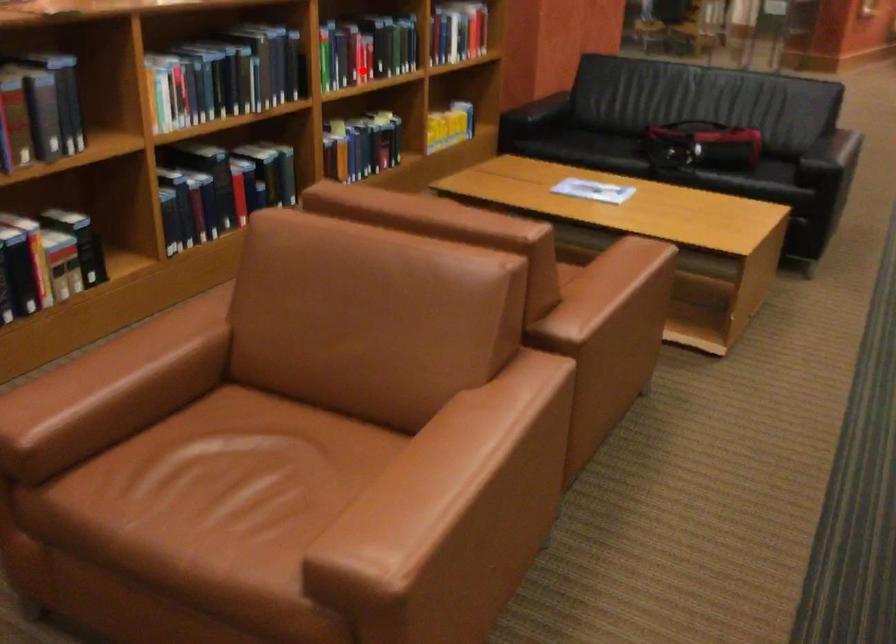
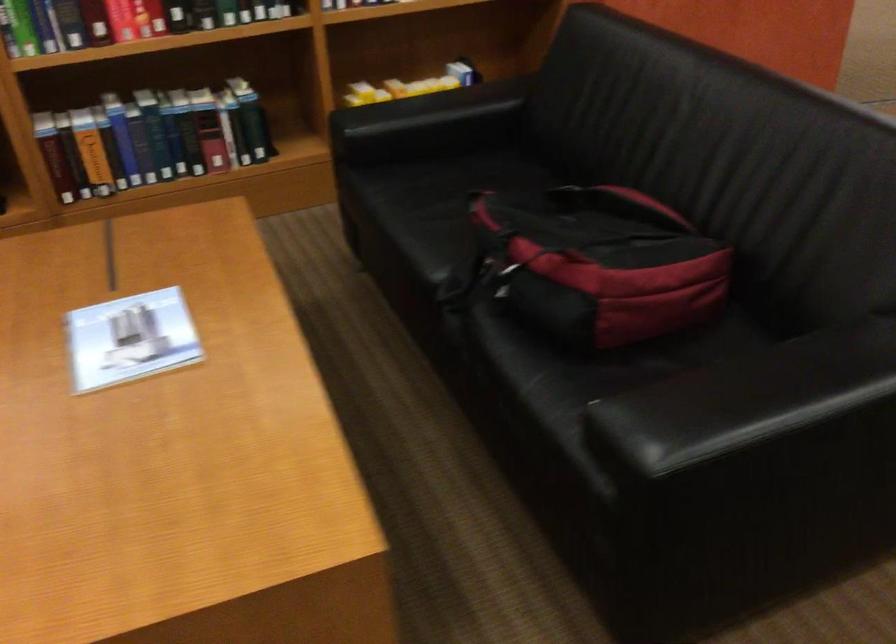
Question: I am providing you with two images of the same scene from different viewpoints. A red point is marked on the first image. Is the red point's position out of view in image 2?

Choices:
 (A) Yes
 (B) No

Answer: (B)